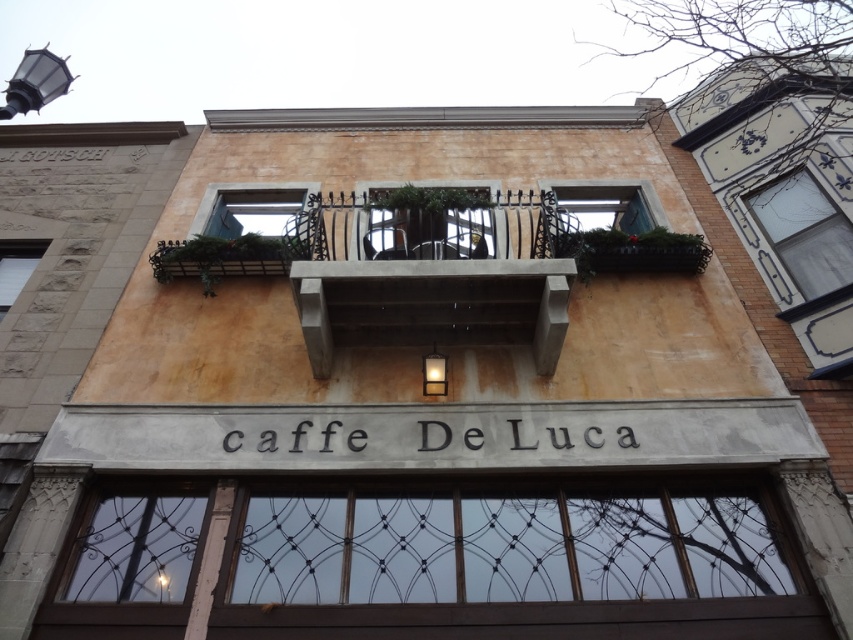
Does brown wooden window at lower center have a greater width compared to concrete at center?

Yes.

Who is more forward, (242, 552) or (537, 349)?

Point (242, 552) is more forward.

Does point (277, 552) come closer to viewer compared to point (384, 208)?

Yes, point (277, 552) is in front of point (384, 208).

Find the location of a particular element. The height and width of the screenshot is (640, 853). brown wooden window at lower center is located at coordinates (434, 560).